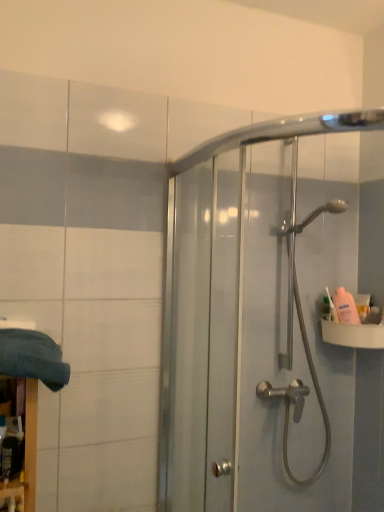
Question: Can you confirm if pink plastic bottle at right is wider than white plastic sink at right?

Choices:
 (A) no
 (B) yes

Answer: (A)

Question: Can you confirm if pink plastic bottle at right is thinner than white plastic sink at right?

Choices:
 (A) no
 (B) yes

Answer: (B)

Question: Is pink plastic bottle at right aimed at white plastic sink at right?

Choices:
 (A) yes
 (B) no

Answer: (B)

Question: Is white plastic sink at right located within pink plastic bottle at right?

Choices:
 (A) no
 (B) yes

Answer: (A)

Question: From the image's perspective, is pink plastic bottle at right below white plastic sink at right?

Choices:
 (A) no
 (B) yes

Answer: (A)

Question: Would you say dark blue fabric at lower left is inside or outside pink plastic bottle at right?

Choices:
 (A) inside
 (B) outside

Answer: (B)

Question: Is dark blue fabric at lower left wider or thinner than pink plastic bottle at right?

Choices:
 (A) thin
 (B) wide

Answer: (B)

Question: Would you say dark blue fabric at lower left is to the left or to the right of pink plastic bottle at right in the picture?

Choices:
 (A) left
 (B) right

Answer: (A)

Question: Is point (49, 357) positioned closer to the camera than point (327, 293)?

Choices:
 (A) closer
 (B) farther

Answer: (A)

Question: Do you think clear glass shower door at upper right is within dark blue fabric at lower left, or outside of it?

Choices:
 (A) outside
 (B) inside

Answer: (A)

Question: In the image, is clear glass shower door at upper right on the left side or the right side of dark blue fabric at lower left?

Choices:
 (A) left
 (B) right

Answer: (B)

Question: Is clear glass shower door at upper right wider or thinner than dark blue fabric at lower left?

Choices:
 (A) thin
 (B) wide

Answer: (A)

Question: From a real-world perspective, is clear glass shower door at upper right positioned above or below dark blue fabric at lower left?

Choices:
 (A) above
 (B) below

Answer: (A)

Question: Is white plastic sink at right taller or shorter than clear glass shower door at upper right?

Choices:
 (A) short
 (B) tall

Answer: (A)

Question: From the image's perspective, is white plastic sink at right located above or below clear glass shower door at upper right?

Choices:
 (A) above
 (B) below

Answer: (B)